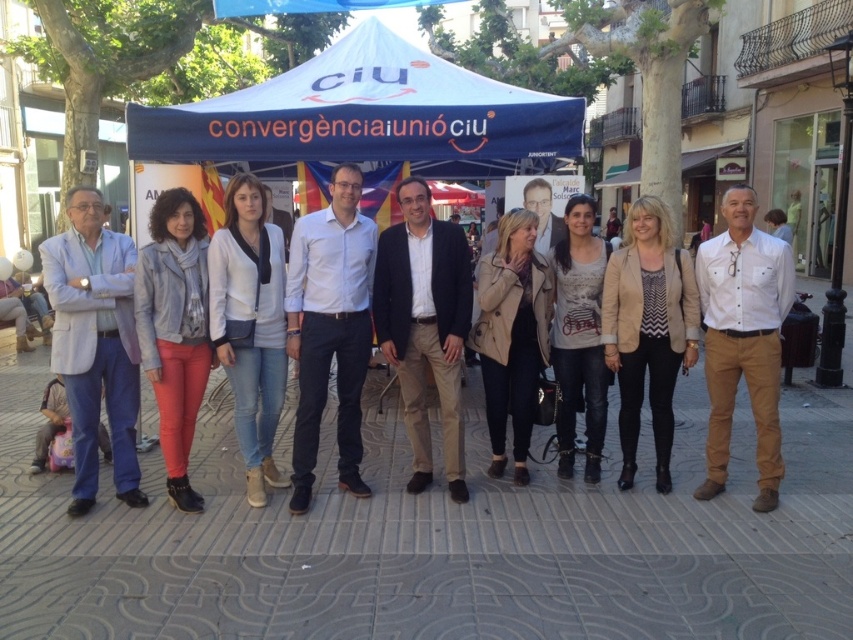
Question: Can you confirm if gray concrete pavement at center is positioned below white cotton shirt at center?

Choices:
 (A) yes
 (B) no

Answer: (A)

Question: Is light blue fabric blazer at left below light brown cotton pants at center?

Choices:
 (A) no
 (B) yes

Answer: (B)

Question: Which point is closer to the camera?

Choices:
 (A) leather jacket at center
 (B) light brown cotton pants at center
 (C) white cotton shirt at center
 (D) white cotton t-shirt at center

Answer: (A)

Question: Which of the following is the farthest from the observer?

Choices:
 (A) (531, 301)
 (B) (746, 196)
 (C) (166, 435)
 (D) (260, 378)

Answer: (A)

Question: Which of the following is the closest to the observer?

Choices:
 (A) (668, 433)
 (B) (712, 385)

Answer: (B)

Question: Is blue shirt at center further to the viewer compared to white cotton shirt at center?

Choices:
 (A) yes
 (B) no

Answer: (A)